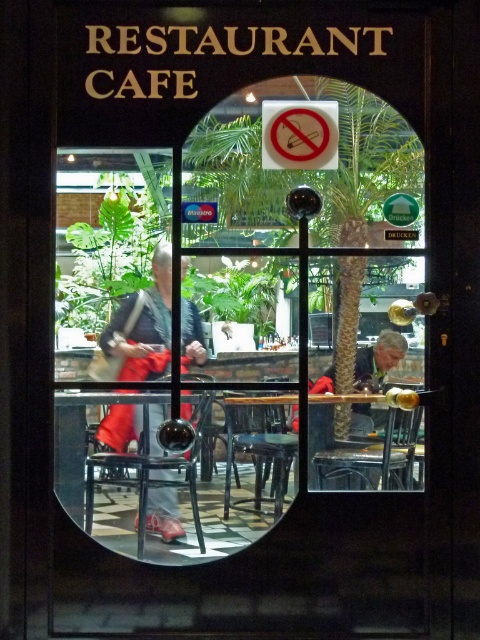
You are a customer entering the cafe and see two jackets hanging on a rack near the entrance. The matte black jacket at center and the gray fabric jacket at lower center. Which jacket is positioned to the left when facing the jackets from the entrance?

The matte black jacket at center is positioned to the left of the gray fabric jacket at lower center when facing the jackets from the entrance.

You are standing outside the restaurant cafe looking through the rounded window. There is a point at coordinate (369, 365) inside the window. If you want to place a small plant exactly halfway between these two points, where should you place it?

The point at coordinate (369, 365) is 2.86 meters away from the other point. To place the small plant exactly halfway, it should be placed at the midpoint between the two points, which would be at coordinates calculated by averaging the x and y values of both points.

You are a customer entering the cafe and see two jackets hanging on a rack near the entrance. The jackets are the matte black jacket at center and the gray fabric jacket at lower center. Which jacket takes up more space horizontally?

The gray fabric jacket at lower center takes up more space horizontally because it has a greater width than the matte black jacket at center.